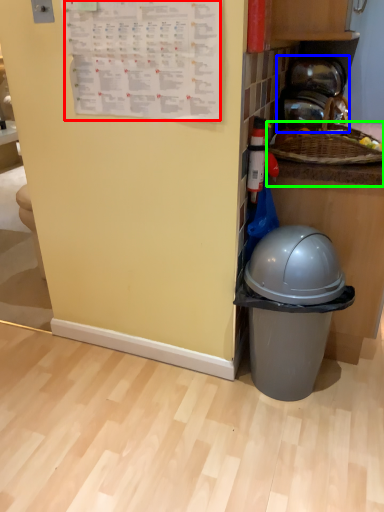
Question: Which object is positioned farthest from writing (highlighted by a red box)? Select from appliance (highlighted by a blue box) and counter top (highlighted by a green box).

Choices:
 (A) appliance
 (B) counter top

Answer: (A)